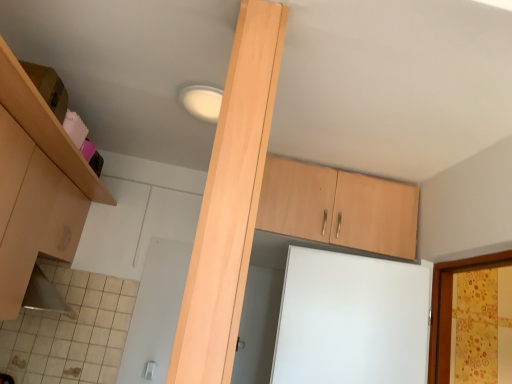
Question: Considering the relative sizes of light wood beam at center and light wood cabinet at upper center, acting as the first cabinetry starting from the right, in the image provided, is light wood beam at center bigger than light wood cabinet at upper center, acting as the first cabinetry starting from the right,?

Choices:
 (A) yes
 (B) no

Answer: (B)

Question: From a real-world perspective, is light wood beam at center under light wood cabinet at upper center, the second cabinetry viewed from the left?

Choices:
 (A) yes
 (B) no

Answer: (A)

Question: Is light wood beam at center positioned in front of light wood cabinet at upper center, the second cabinetry viewed from the left?

Choices:
 (A) yes
 (B) no

Answer: (A)

Question: Is light wood beam at center facing towards light wood cabinet at upper center, the second cabinetry viewed from the left?

Choices:
 (A) no
 (B) yes

Answer: (A)

Question: From the image's perspective, does light wood beam at center appear lower than light wood cabinet at upper center, the second cabinetry viewed from the left?

Choices:
 (A) yes
 (B) no

Answer: (B)

Question: Is light wood beam at center to the right of light wood cabinet at upper center, acting as the first cabinetry starting from the right, from the viewer's perspective?

Choices:
 (A) yes
 (B) no

Answer: (B)

Question: Is light wood cabinet at upper center, acting as the first cabinetry starting from the right, outside of matte wood cabinet at upper left, which is counted as the first cabinetry, starting from the left?

Choices:
 (A) yes
 (B) no

Answer: (A)

Question: Does light wood cabinet at upper center, acting as the first cabinetry starting from the right, come in front of matte wood cabinet at upper left, positioned as the 2th cabinetry in right-to-left order?

Choices:
 (A) yes
 (B) no

Answer: (B)

Question: From a real-world perspective, does light wood cabinet at upper center, the second cabinetry viewed from the left, sit lower than matte wood cabinet at upper left, positioned as the 2th cabinetry in right-to-left order?

Choices:
 (A) yes
 (B) no

Answer: (B)

Question: Does light wood cabinet at upper center, the second cabinetry viewed from the left, have a smaller size compared to matte wood cabinet at upper left, which is counted as the first cabinetry, starting from the left?

Choices:
 (A) no
 (B) yes

Answer: (B)

Question: Considering the relative sizes of light wood cabinet at upper center, the second cabinetry viewed from the left, and matte wood cabinet at upper left, positioned as the 2th cabinetry in right-to-left order, in the image provided, is light wood cabinet at upper center, the second cabinetry viewed from the left, wider than matte wood cabinet at upper left, positioned as the 2th cabinetry in right-to-left order,?

Choices:
 (A) no
 (B) yes

Answer: (B)

Question: Does light wood cabinet at upper center, the second cabinetry viewed from the left, appear on the left side of matte wood cabinet at upper left, positioned as the 2th cabinetry in right-to-left order?

Choices:
 (A) no
 (B) yes

Answer: (A)

Question: From a real-world perspective, is matte wood cabinet at upper left, positioned as the 2th cabinetry in right-to-left order, on light wood beam at center?

Choices:
 (A) yes
 (B) no

Answer: (B)